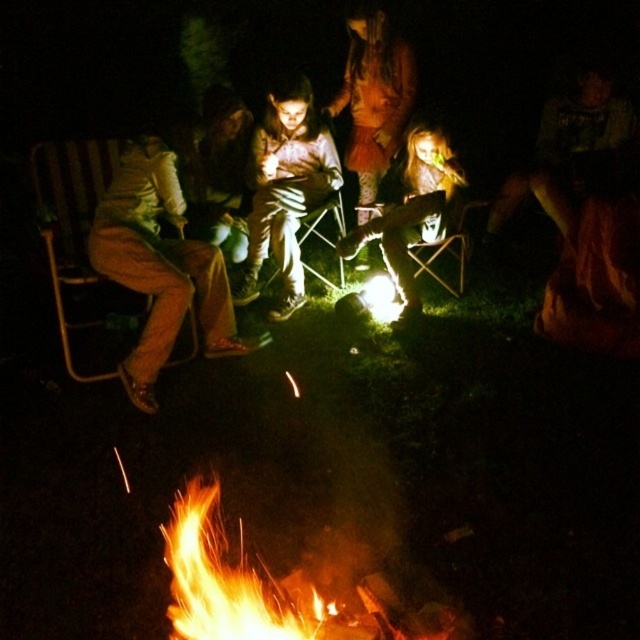
You are a hiker who needs to pass between the person wearing the matte brown pants at left and the person wearing the matte black jacket at center. Your backpack is 1 meter wide. Can you fit through the space between them?

The distance between the matte brown pants at left and the matte black jacket at center is 1.22 meters. Since your backpack is 1 meter wide, you can fit through the space between them as the distance is wider than your backpack.

You are a photographer trying to capture a group photo of the matte brown pants at left and the matte black jacket at center. Since you want to include both subjects in the frame, which direction should you position your camera relative to the campfire?

The matte brown pants at left is positioned on the left side of matte black jacket at center, so you should position your camera to the left of the campfire to include both subjects in the frame.

You are a photographer trying to capture a clear shot of the matte brown pants at left and the matte black jacket at center in the campfire scene. Since the fire is the brightest part of the image, which object might be more challenging to photograph clearly due to its size and position relative to the fire?

The matte brown pants at left is bigger than the matte black jacket at center, so it might be more challenging to photograph clearly because its larger size could cause parts of it to be overexposed or out of focus if the camera focuses on the bright fire.